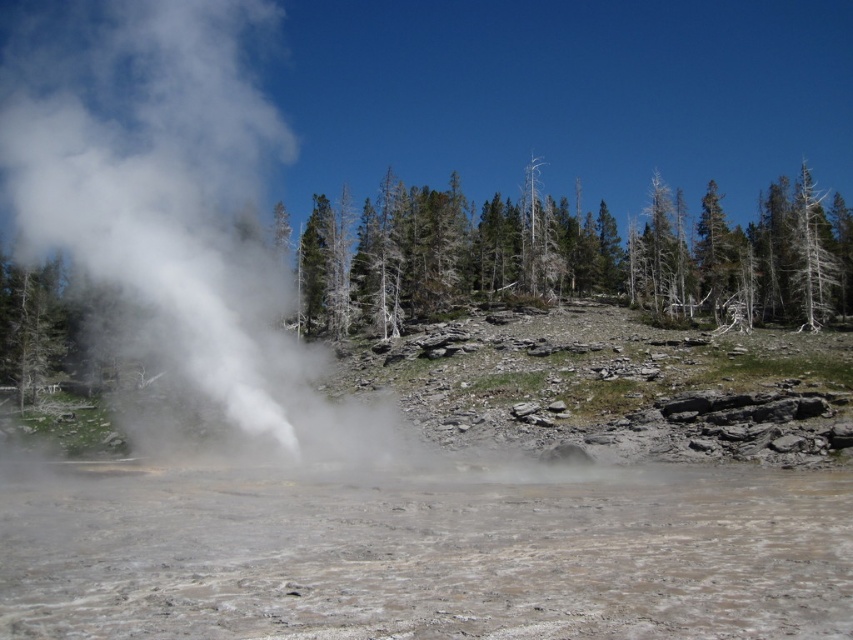
Who is shorter, muddy water at center or dead wood trees at center?

muddy water at center

Based on the photo, which of these two, muddy water at center or dead wood trees at center, stands taller?

dead wood trees at center is taller.

Is point (825, 566) closer to camera compared to point (564, 288)?

Yes, it is.

Image resolution: width=853 pixels, height=640 pixels. Identify the location of muddy water at center. point(428,556).

Does muddy water at center have a lesser height compared to white vapor at center?

Yes.

Between point (815, 476) and point (7, 33), which one is positioned in front?

Positioned in front is point (815, 476).

At what (x,y) coordinates should I click in order to perform the action: click on muddy water at center. Please return your answer as a coordinate pair (x, y). The image size is (853, 640). Looking at the image, I should click on (428, 556).

At what (x,y) coordinates should I click in order to perform the action: click on muddy water at center. Please return your answer as a coordinate pair (x, y). This screenshot has height=640, width=853. Looking at the image, I should click on (428, 556).

Is white vapor at center below dead wood trees at center?

Incorrect, white vapor at center is not positioned below dead wood trees at center.

Does white vapor at center have a greater width compared to dead wood trees at center?

No.

This screenshot has height=640, width=853. What are the coordinates of `white vapor at center` in the screenshot? It's located at (170, 198).